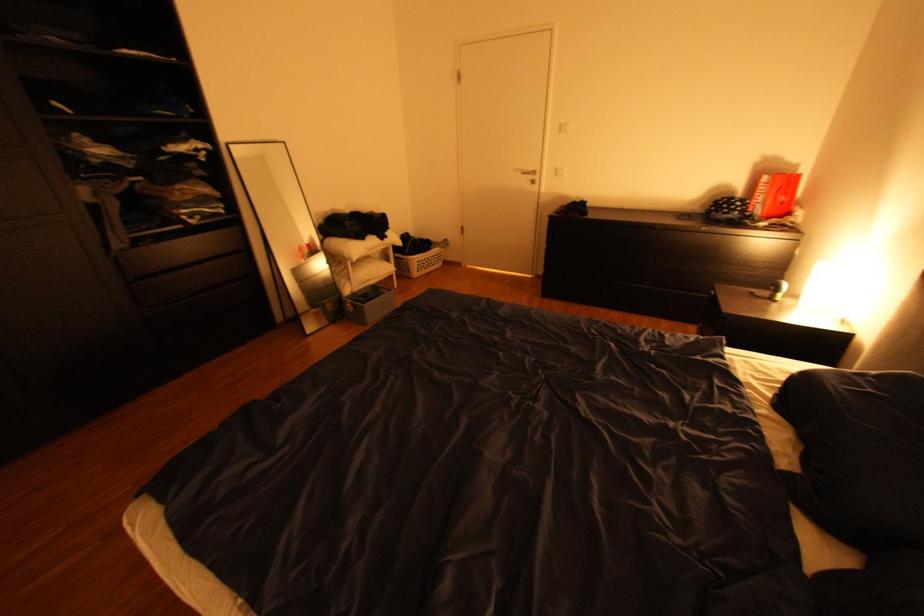
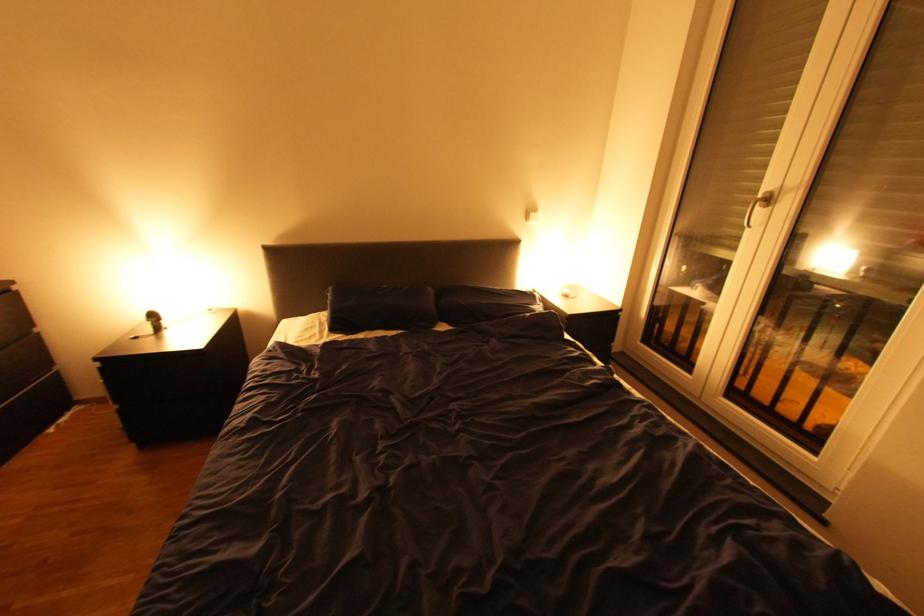
Where in the second image is the point corresponding to (x=785, y=395) from the first image?

(348, 333)